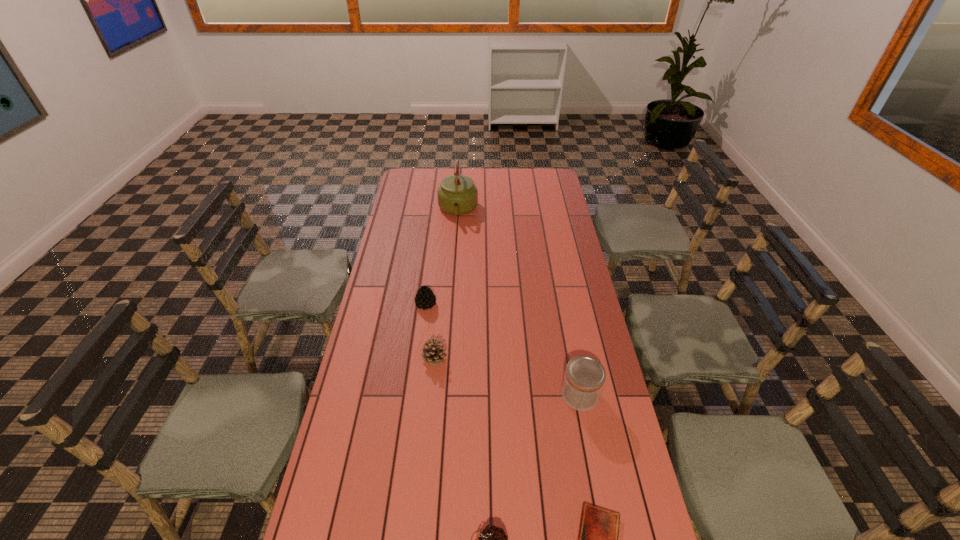
You are a GUI agent. You are given a task and a screenshot of the screen. Output one action in this format:
    pyautogui.click(x=<x>, y=<y>)
    Task: Click on the tallest object
    This screenshot has width=960, height=540.
    Given the screenshot: What is the action you would take?
    pyautogui.click(x=457, y=194)

At what (x,y) coordinates should I click in order to perform the action: click on kettle. Please return your answer as a coordinate pair (x, y). The width and height of the screenshot is (960, 540). Looking at the image, I should click on (457, 194).

Locate an element on the screen. the second tallest object is located at coordinates (584, 378).

Identify the location of jar. (584, 378).

Identify the location of the fourth nearest object. (432, 352).

Locate an element on the screen. Image resolution: width=960 pixels, height=540 pixels. the second farthest object is located at coordinates (425, 298).

I want to click on vacant region located at the spout of the farthest object, so click(455, 256).

Where is `vacant area situated on the back of the third nearest object`? This screenshot has width=960, height=540. vacant area situated on the back of the third nearest object is located at coordinates (561, 294).

Find the location of a particular element. This screenshot has width=960, height=540. free spot located on the left of the third farthest object is located at coordinates (383, 358).

You are a GUI agent. You are given a task and a screenshot of the screen. Output one action in this format:
    pyautogui.click(x=<x>, y=<y>)
    Task: Click on the vacant point located 0.050m at the narrow end of the farthest pinecone
    The width and height of the screenshot is (960, 540).
    Given the screenshot: What is the action you would take?
    pyautogui.click(x=423, y=321)